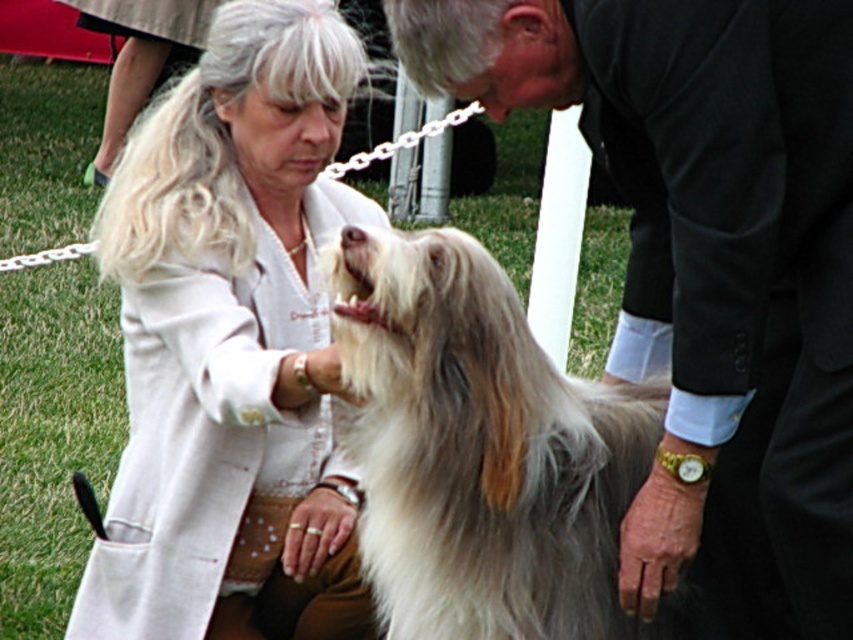
Question: Does fluffy beige dog at center appear under white textured coat at center?

Choices:
 (A) no
 (B) yes

Answer: (B)

Question: Can you confirm if white textured coat at center is positioned above fluffy white dog at center?

Choices:
 (A) yes
 (B) no

Answer: (A)

Question: Estimate the real-world distances between objects in this image. Which object is closer to the fluffy beige dog at center?

Choices:
 (A) white textured coat at center
 (B) fluffy white dog at center

Answer: (B)

Question: Can you confirm if white textured coat at center is positioned to the left of fluffy white dog at center?

Choices:
 (A) yes
 (B) no

Answer: (A)

Question: Which object appears farthest from the camera in this image?

Choices:
 (A) fluffy beige dog at center
 (B) white textured coat at center

Answer: (B)

Question: Which is farther from the white textured coat at center?

Choices:
 (A) fluffy white dog at center
 (B) fluffy beige dog at center

Answer: (B)